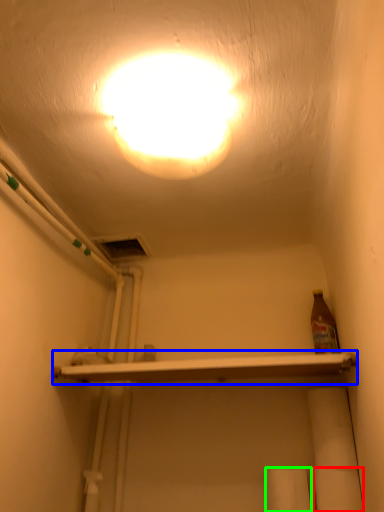
Question: Estimate the real-world distances between objects in this image. Which object is closer to toilet paper (highlighted by a red box), shelf (highlighted by a blue box) or toilet paper (highlighted by a green box)?

Choices:
 (A) shelf
 (B) toilet paper

Answer: (B)